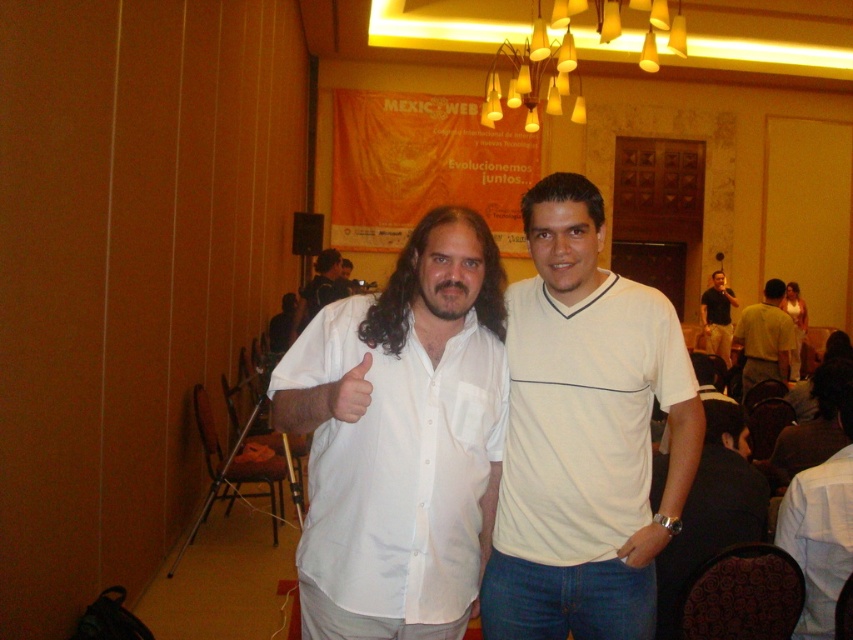
Who is more distant from viewer, (792, 532) or (784, 360)?

Point (784, 360)

Does point (805, 618) come closer to viewer compared to point (740, 346)?

Yes, it is.

The image size is (853, 640). What do you see at coordinates (819, 538) in the screenshot?
I see `white cotton shirt at center` at bounding box center [819, 538].

This screenshot has width=853, height=640. What are the coordinates of `white cotton shirt at center` in the screenshot? It's located at (819, 538).

Can you confirm if white button-down shirt at center is smaller than yellow cotton shirt at center?

Indeed, white button-down shirt at center has a smaller size compared to yellow cotton shirt at center.

Which is more to the left, white button-down shirt at center or yellow cotton shirt at center?

white button-down shirt at center is more to the left.

Who is more distant from viewer, [408,429] or [772,310]?

The point [772,310] is behind.

You are a GUI agent. You are given a task and a screenshot of the screen. Output one action in this format:
    pyautogui.click(x=<x>, y=<y>)
    Task: Click on the white button-down shirt at center
    Image resolution: width=853 pixels, height=640 pixels.
    Given the screenshot: What is the action you would take?
    pyautogui.click(x=398, y=467)

Which is behind, point (730, 298) or point (317, 291)?

Positioned behind is point (730, 298).

Does dark brown leather shirt at center have a greater height compared to white shirt at center?

Yes, dark brown leather shirt at center is taller than white shirt at center.

This screenshot has height=640, width=853. In order to click on dark brown leather shirt at center in this screenshot , I will do `click(717, 316)`.

The image size is (853, 640). Identify the location of dark brown leather shirt at center. (717, 316).